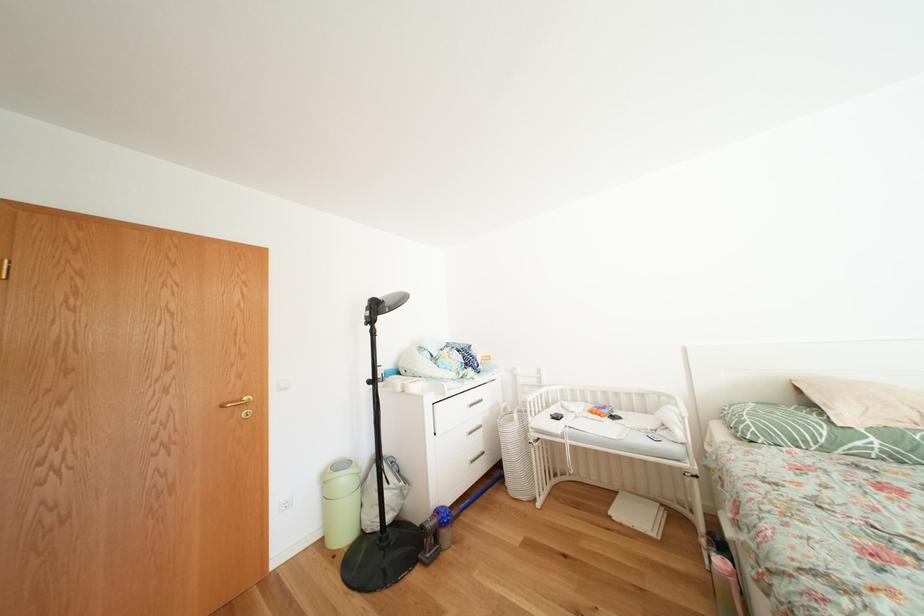
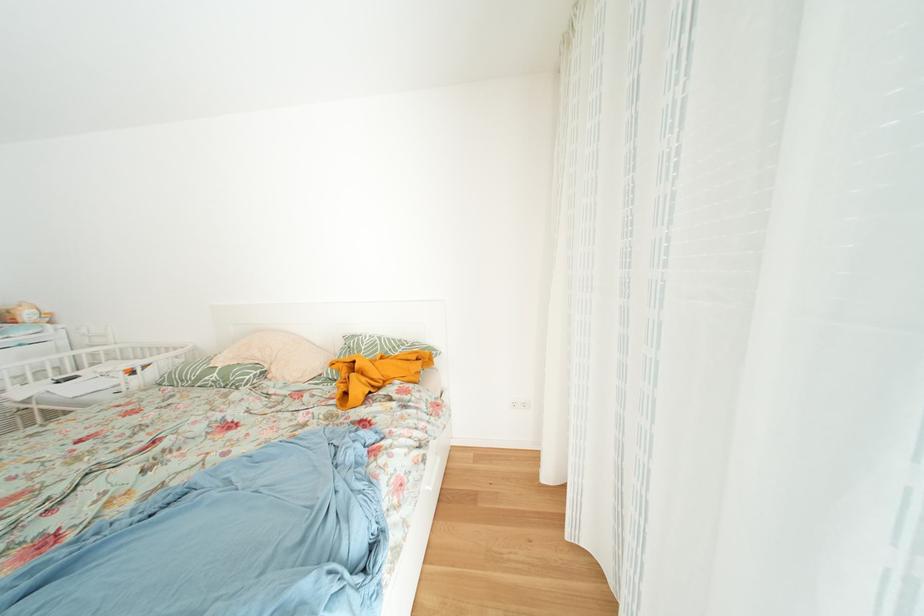
In the second image, find the point that corresponds to (844,448) in the first image.

(208, 384)